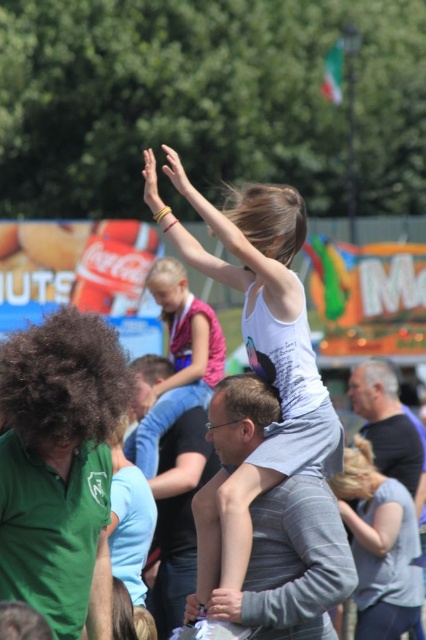
Question: Which object is the closest to the dark gray shirt at upper right?

Choices:
 (A) white matte tank top at center
 (B) gray striped shirt at center

Answer: (A)

Question: Which of these objects is positioned closest to the green matte shirt at left?

Choices:
 (A) gray striped shirt at center
 (B) light blue fabric shirt at center
 (C) white matte tank top at center
 (D) pink fabric dress at upper center

Answer: (C)

Question: Is gray striped shirt at center to the right of light blue fabric shirt at center from the viewer's perspective?

Choices:
 (A) yes
 (B) no

Answer: (B)

Question: Which point is farther from the camera taking this photo?

Choices:
 (A) (250, 580)
 (B) (57, 483)
 (C) (164, 257)

Answer: (C)

Question: Can you confirm if green matte shirt at left is bigger than pink fabric dress at upper center?

Choices:
 (A) no
 (B) yes

Answer: (A)

Question: Does white matte tank top at center come behind pink fabric dress at upper center?

Choices:
 (A) yes
 (B) no

Answer: (B)